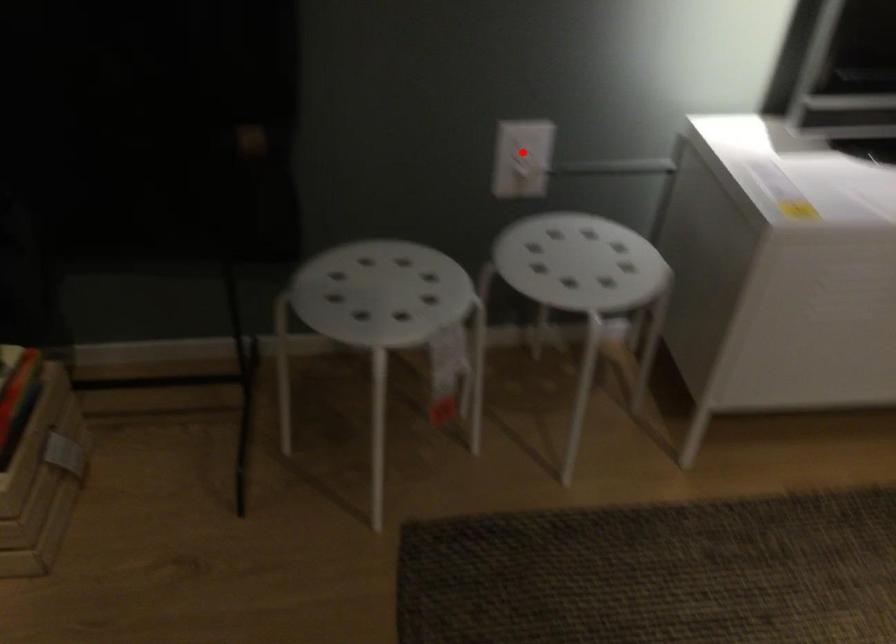
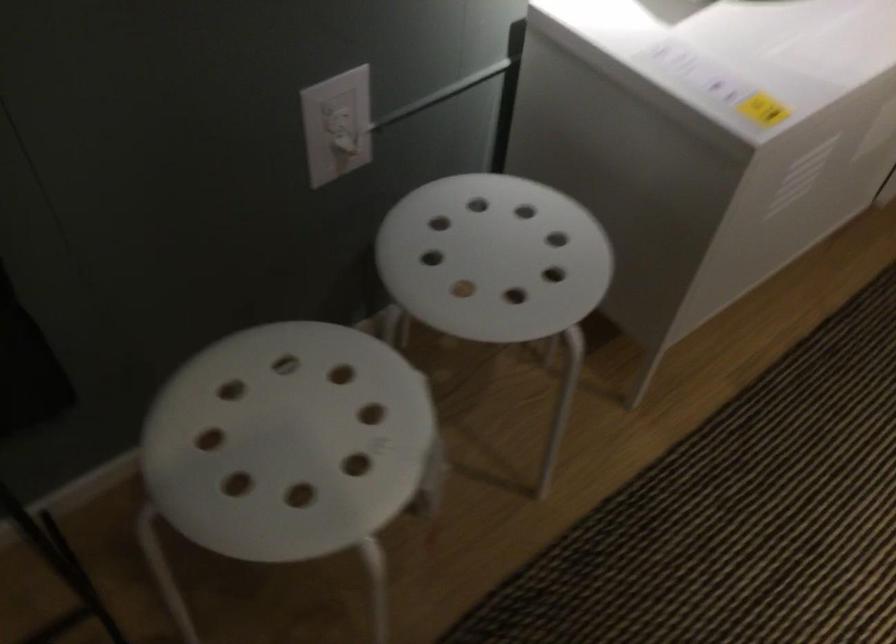
Where in the second image is the point corresponding to the highlighted location from the first image?

(337, 125)